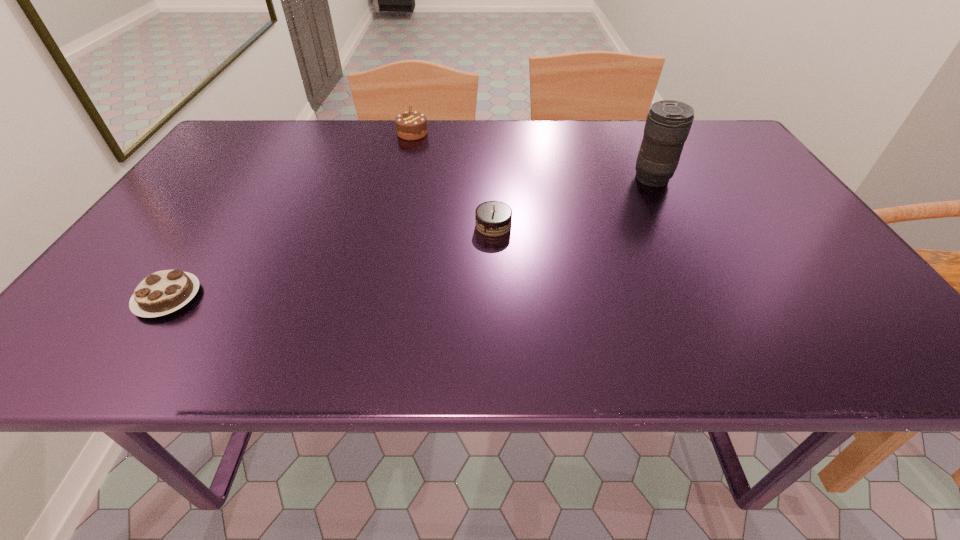
Where is `object that is the third closest to the second nearest chocolate cake`? The image size is (960, 540). object that is the third closest to the second nearest chocolate cake is located at coordinates (163, 292).

The height and width of the screenshot is (540, 960). Identify the location of object that is the third closest to the third nearest object. (163, 292).

Where is `chocolate cake object that ranks as the second closest to the nearest object`? The image size is (960, 540). chocolate cake object that ranks as the second closest to the nearest object is located at coordinates (410, 125).

Locate an element on the screen. This screenshot has width=960, height=540. chocolate cake that can be found as the closest to the third nearest object is located at coordinates (492, 218).

Find the location of a particular element. Image resolution: width=960 pixels, height=540 pixels. free spot that satisfies the following two spatial constraints: 1. on the back side of the shortest chocolate cake; 2. on the left side of the farthest object is located at coordinates (278, 133).